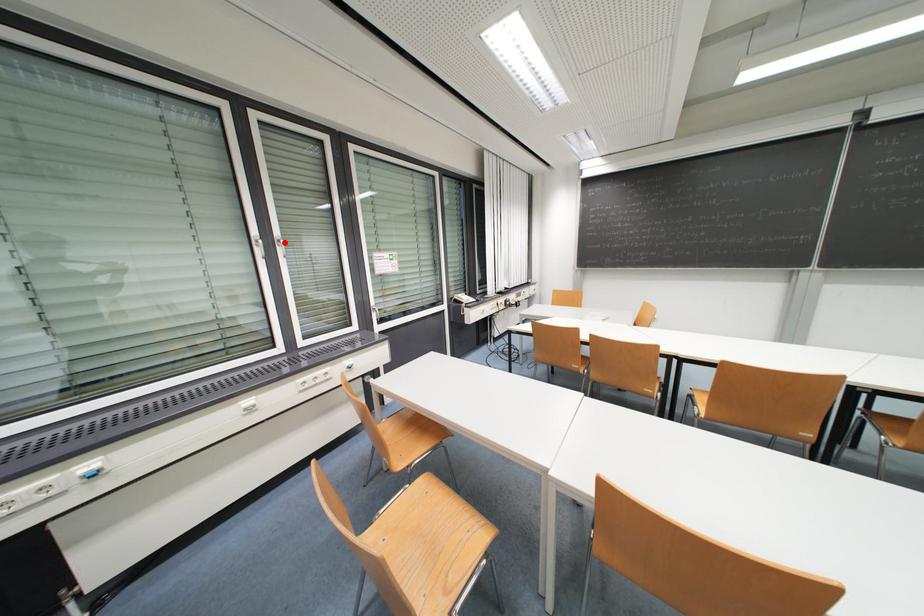
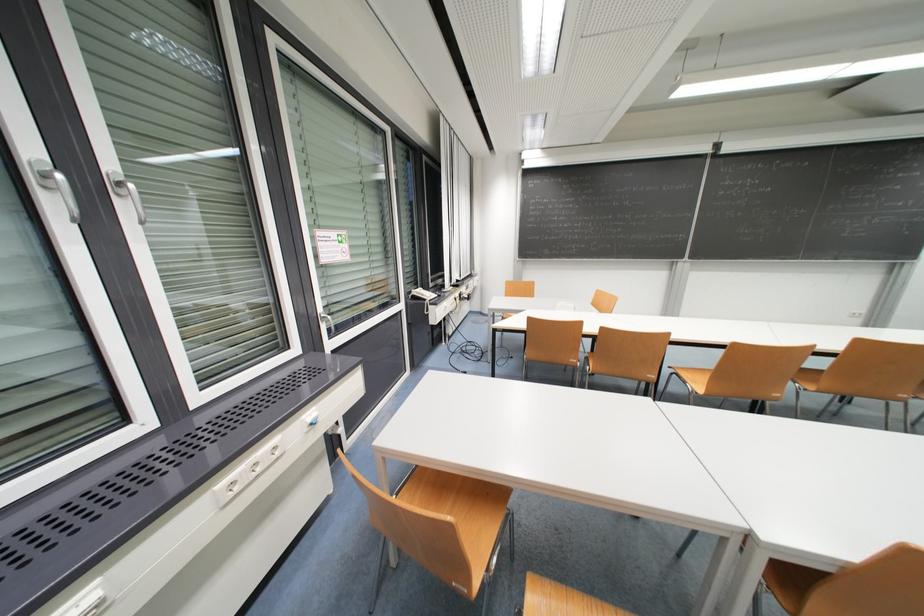
Where in the second image is the point corresponding to the highlighted location from the first image?

(126, 185)